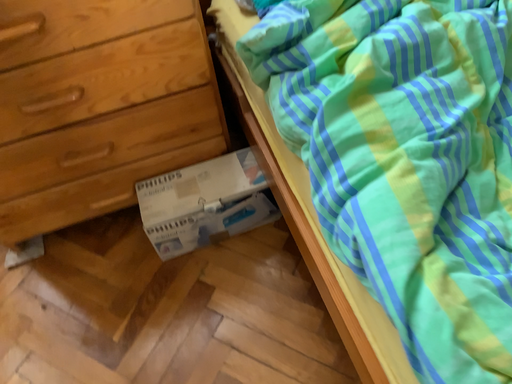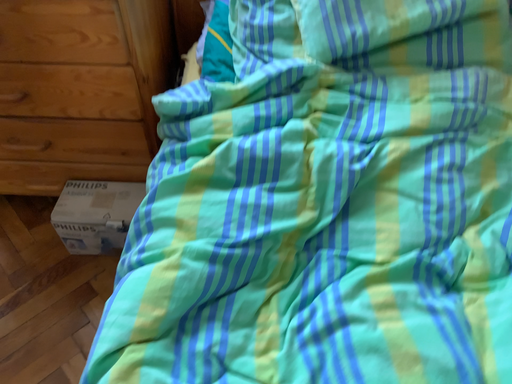
Question: How did the camera likely rotate when shooting the video?

Choices:
 (A) rotated right
 (B) rotated left

Answer: (B)